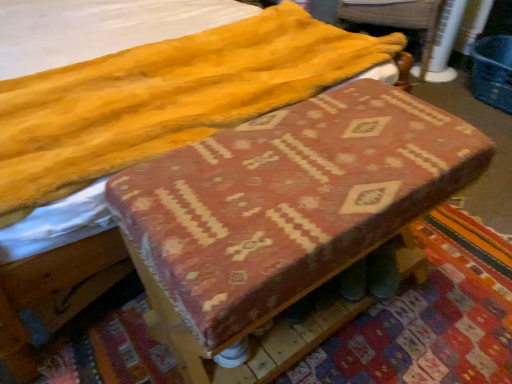
Measure the distance between point (396, 22) and camera.

A distance of 2.24 meters exists between point (396, 22) and camera.

This screenshot has width=512, height=384. In order to click on wooden swivel chair at upper right in this screenshot , I will do `click(400, 20)`.

Describe the element at coordinates (400, 20) in the screenshot. I see `wooden swivel chair at upper right` at that location.

Measure the distance between wooden swivel chair at upper right and camera.

wooden swivel chair at upper right and camera are 7.07 feet apart.

Identify the location of textured fabric changing table at center. The height and width of the screenshot is (384, 512). (289, 201).

Describe the element at coordinates (289, 201) in the screenshot. I see `textured fabric changing table at center` at that location.

What are the coordinates of `wooden swivel chair at upper right` in the screenshot? It's located at (400, 20).

Can you confirm if textured fabric changing table at center is positioned to the right of wooden swivel chair at upper right?

No.

Is the position of textured fabric changing table at center more distant than that of wooden swivel chair at upper right?

No, it is not.

Is point (188, 298) closer or farther from the camera than point (392, 10)?

Point (188, 298) is positioned closer to the camera compared to point (392, 10).

From the image's perspective, is textured fabric changing table at center above wooden swivel chair at upper right?

Incorrect, from the image's perspective, textured fabric changing table at center is lower than wooden swivel chair at upper right.

From a real-world perspective, is textured fabric changing table at center located beneath wooden swivel chair at upper right?

No, from a real-world perspective, textured fabric changing table at center is not under wooden swivel chair at upper right.

Can you confirm if textured fabric changing table at center is wider than wooden swivel chair at upper right?

In fact, textured fabric changing table at center might be narrower than wooden swivel chair at upper right.

Can you confirm if textured fabric changing table at center is shorter than wooden swivel chair at upper right?

No.

Can you confirm if textured fabric changing table at center is bigger than wooden swivel chair at upper right?

Indeed, textured fabric changing table at center has a larger size compared to wooden swivel chair at upper right.

Is textured fabric changing table at center situated inside wooden swivel chair at upper right or outside?

textured fabric changing table at center is spatially situated outside wooden swivel chair at upper right.

Is textured fabric changing table at center next to wooden swivel chair at upper right?

textured fabric changing table at center and wooden swivel chair at upper right are not in contact.

Is textured fabric changing table at center positioned with its back to wooden swivel chair at upper right?

No, textured fabric changing table at center is not facing away from wooden swivel chair at upper right.

What's the angular difference between textured fabric changing table at center and wooden swivel chair at upper right's facing directions?

textured fabric changing table at center and wooden swivel chair at upper right are facing 59.1 degrees away from each other.

I want to click on swivel chair lying above the textured fabric changing table at center (from the image's perspective), so click(400, 20).

In the image, is wooden swivel chair at upper right on the left side or the right side of textured fabric changing table at center?

From the image, it's evident that wooden swivel chair at upper right is to the right of textured fabric changing table at center.

Is wooden swivel chair at upper right in front of or behind textured fabric changing table at center in the image?

wooden swivel chair at upper right is behind textured fabric changing table at center.

Is point (391, 12) closer or farther from the camera than point (375, 133)?

Point (391, 12) is farther from the camera than point (375, 133).

From the image's perspective, who appears lower, wooden swivel chair at upper right or textured fabric changing table at center?

textured fabric changing table at center is shown below in the image.

In the scene shown: From a real-world perspective, is wooden swivel chair at upper right below textured fabric changing table at center?

Yes, from a real-world perspective, wooden swivel chair at upper right is under textured fabric changing table at center.

Does wooden swivel chair at upper right have a lesser width compared to textured fabric changing table at center?

No, wooden swivel chair at upper right is not thinner than textured fabric changing table at center.

Who is taller, wooden swivel chair at upper right or textured fabric changing table at center?

textured fabric changing table at center.

Is wooden swivel chair at upper right bigger than textured fabric changing table at center?

No, wooden swivel chair at upper right is not bigger than textured fabric changing table at center.

Can we say wooden swivel chair at upper right lies outside textured fabric changing table at center?

Yes.

Are wooden swivel chair at upper right and textured fabric changing table at center making contact?

No, wooden swivel chair at upper right is not beside textured fabric changing table at center.

Could you tell me if wooden swivel chair at upper right is facing textured fabric changing table at center?

Yes, wooden swivel chair at upper right is facing textured fabric changing table at center.

How many degrees apart are the facing directions of wooden swivel chair at upper right and textured fabric changing table at center?

They differ by 59.1 degrees in their facing directions.

Locate an element on the screen. swivel chair to the right of textured fabric changing table at center is located at coordinates (400, 20).

This screenshot has height=384, width=512. In order to click on swivel chair lying behind the textured fabric changing table at center in this screenshot , I will do `click(400, 20)`.

Identify the location of swivel chair on the right side of textured fabric changing table at center. (400, 20).